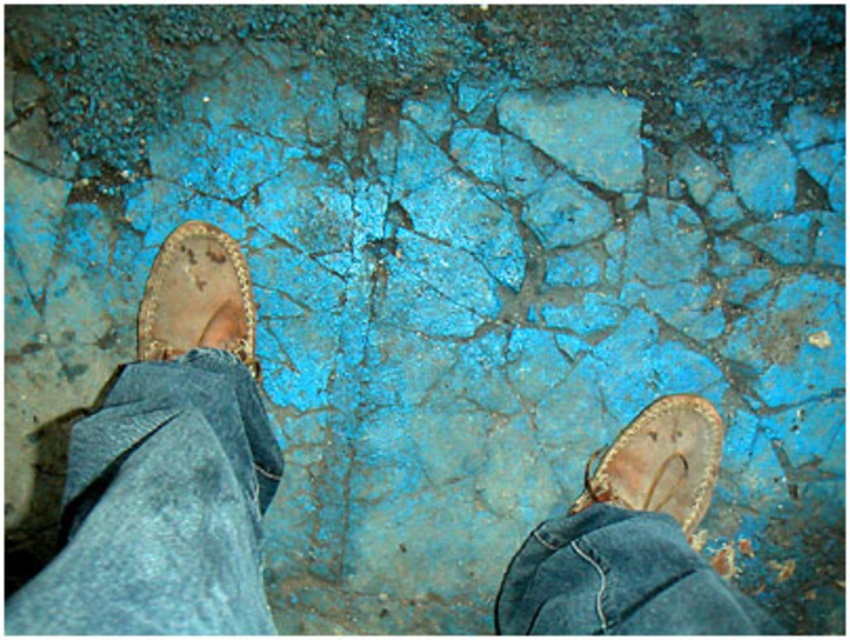
Looking at this image, you are an interior designer assessing the placement of two leather sandals in a room. Given that the leather sandal at lower right is bigger than the leather sandal at left, which sandal would require more floor space to avoid overlapping with the other?

The leather sandal at lower right requires more floor space because it is bigger than the leather sandal at left, so it needs more space to avoid overlapping.

You are a photographer trying to capture a close detail shot of the textured surface between the denim at lower right and the leather sandal at lower right. Based on their widths, which object will you focus on to ensure the shot includes more of the textured surface?

The denim at lower right has a greater width than the leather sandal at lower right, so focusing on the denim at lower right will include more of the textured surface in the shot.

In the scene shown: You are standing in a room with two leather sandals on the floor. You need to pick up the sandal that is closer to you. Which one should you choose between the leather sandal at lower right and the leather sandal at left?

You should pick up the leather sandal at lower right because it is closer to you than the leather sandal at left.